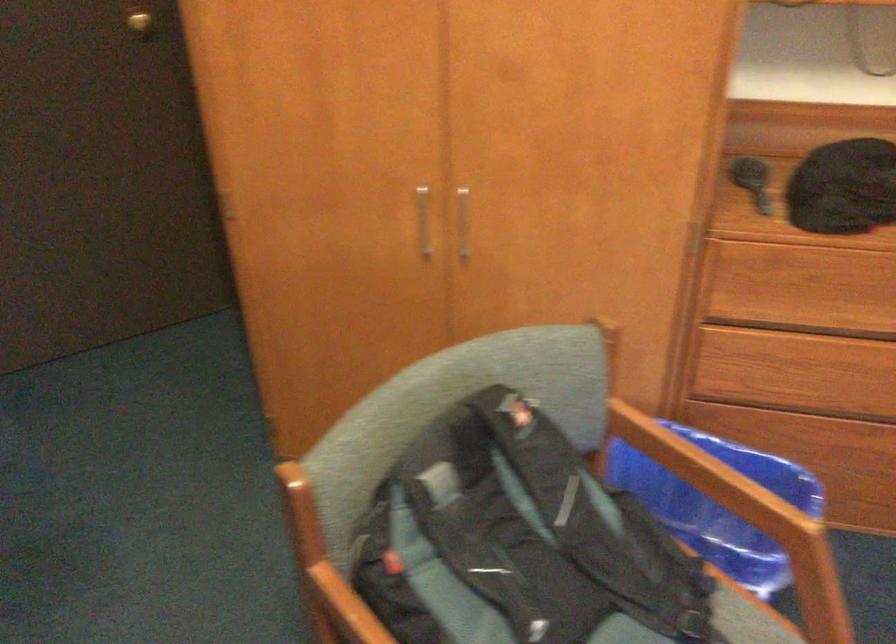
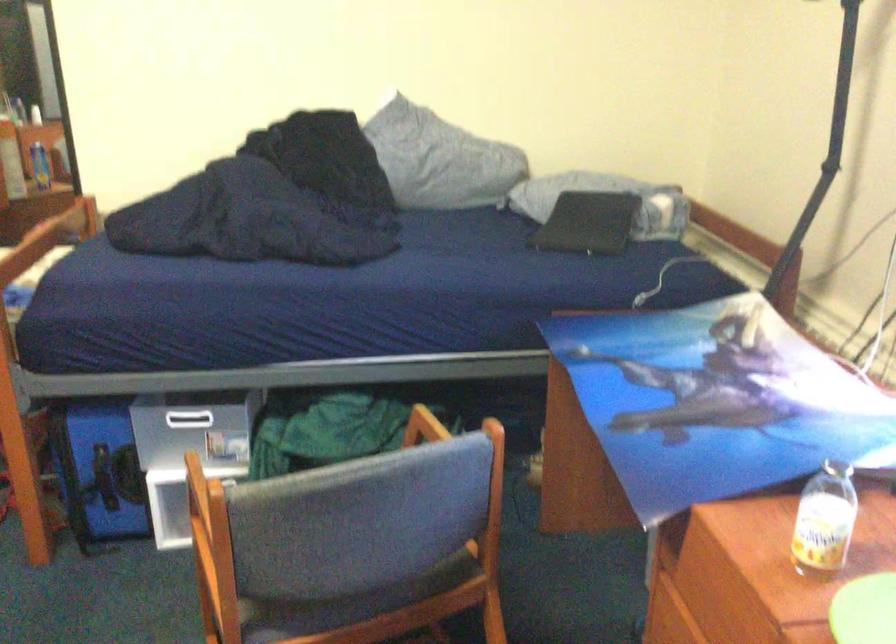
Question: The camera is either moving clockwise (left) or counter-clockwise (right) around the object. The first image is from the beginning of the video and the second image is from the end. Is the camera moving left or right when shooting the video?

Choices:
 (A) Left
 (B) Right

Answer: (A)